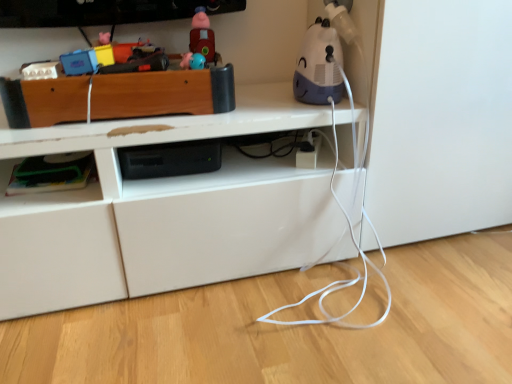
Question: From the image's perspective, is white plastic humidifier at upper right, which ranks as the 2th toy in left-to-right order, under wooden toy box at upper left, the first shelf in the top-to-bottom sequence?

Choices:
 (A) no
 (B) yes

Answer: (A)

Question: Can you confirm if white plastic humidifier at upper right, which is the first toy from right to left, is positioned to the left of wooden toy box at upper left, which is the 2th shelf in bottom-to-top order?

Choices:
 (A) yes
 (B) no

Answer: (B)

Question: From a real-world perspective, is white plastic humidifier at upper right, which ranks as the 2th toy in left-to-right order, under wooden toy box at upper left, the first shelf in the top-to-bottom sequence?

Choices:
 (A) yes
 (B) no

Answer: (B)

Question: Is white plastic humidifier at upper right, which ranks as the 2th toy in left-to-right order, taller than wooden toy box at upper left, the first shelf in the top-to-bottom sequence?

Choices:
 (A) no
 (B) yes

Answer: (B)

Question: Is white plastic humidifier at upper right, which ranks as the 2th toy in left-to-right order, next to wooden toy box at upper left, the first shelf in the top-to-bottom sequence?

Choices:
 (A) yes
 (B) no

Answer: (B)

Question: Is green plastic container at lower left, marked as the second shelf in a top-to-bottom arrangement, facing away from white plastic humidifier at upper right, which ranks as the 2th toy in left-to-right order?

Choices:
 (A) no
 (B) yes

Answer: (A)

Question: Considering the relative sizes of green plastic container at lower left, which is the 1th shelf from bottom to top, and white plastic humidifier at upper right, which is the first toy from right to left, in the image provided, is green plastic container at lower left, which is the 1th shelf from bottom to top, wider than white plastic humidifier at upper right, which is the first toy from right to left,?

Choices:
 (A) no
 (B) yes

Answer: (B)

Question: Does green plastic container at lower left, marked as the second shelf in a top-to-bottom arrangement, appear on the left side of white plastic humidifier at upper right, which is the first toy from right to left?

Choices:
 (A) no
 (B) yes

Answer: (B)

Question: Can you confirm if green plastic container at lower left, which is the 1th shelf from bottom to top, is bigger than white plastic humidifier at upper right, which ranks as the 2th toy in left-to-right order?

Choices:
 (A) yes
 (B) no

Answer: (B)

Question: Is green plastic container at lower left, marked as the second shelf in a top-to-bottom arrangement, thinner than white plastic humidifier at upper right, which ranks as the 2th toy in left-to-right order?

Choices:
 (A) yes
 (B) no

Answer: (B)

Question: From a real-world perspective, is green plastic container at lower left, marked as the second shelf in a top-to-bottom arrangement, on top of white plastic humidifier at upper right, which ranks as the 2th toy in left-to-right order?

Choices:
 (A) no
 (B) yes

Answer: (A)

Question: From the image's perspective, is green plastic container at lower left, marked as the second shelf in a top-to-bottom arrangement, on wooden toy box at upper left, which is the 2th shelf in bottom-to-top order?

Choices:
 (A) yes
 (B) no

Answer: (B)